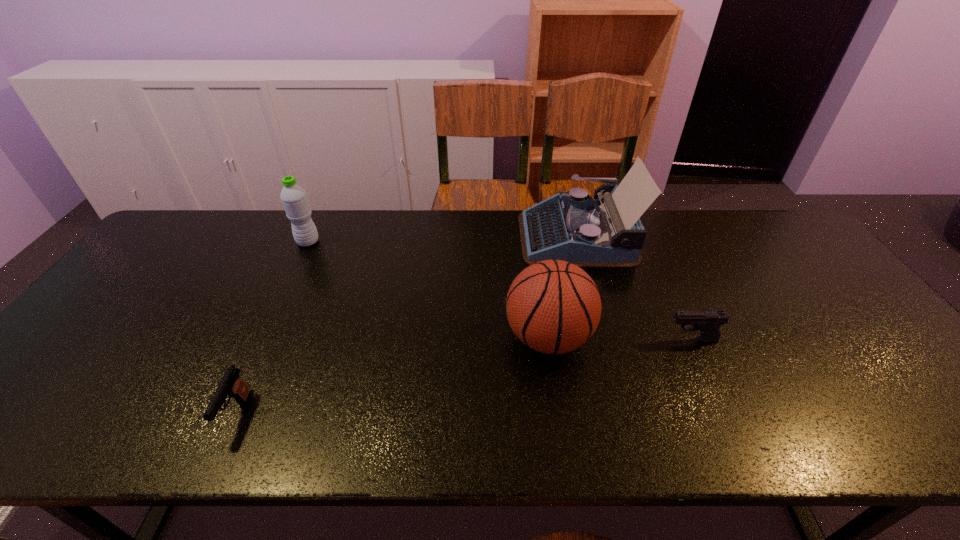
Identify the location of vacant space located 0.120m on the side where the inflation valve is located. The height and width of the screenshot is (540, 960). 457,338.

You are a GUI agent. You are given a task and a screenshot of the screen. Output one action in this format:
    pyautogui.click(x=<x>, y=<y>)
    Task: Click on the free space located 0.110m on the side where the inflation valve is located
    The image size is (960, 540).
    Given the screenshot: What is the action you would take?
    pyautogui.click(x=461, y=338)

Identify the location of free spot located on the side where the inflation valve is located. This screenshot has height=540, width=960. (394, 338).

Image resolution: width=960 pixels, height=540 pixels. Find the location of `blank space located 0.100m at the barrel of the farther pistol`. blank space located 0.100m at the barrel of the farther pistol is located at coordinates pos(627,340).

Image resolution: width=960 pixels, height=540 pixels. What are the coordinates of `vacant region located 0.080m at the barrel of the farther pistol` in the screenshot? It's located at (635, 340).

Where is `free location located 0.300m at the barrel of the farther pistol`? This screenshot has height=540, width=960. free location located 0.300m at the barrel of the farther pistol is located at coordinates click(547, 340).

Locate an element on the screen. The image size is (960, 540). typewriter at the far edge is located at coordinates (589, 233).

What are the coordinates of `water bottle at the far edge` in the screenshot? It's located at (294, 199).

At what (x,y) coordinates should I click in order to perform the action: click on object that is at the near edge. Please return your answer as a coordinate pair (x, y). Looking at the image, I should click on (231, 385).

At what (x,y) coordinates should I click in order to perform the action: click on vacant region at the far edge of the desktop. Please return your answer as a coordinate pair (x, y). The height and width of the screenshot is (540, 960). Looking at the image, I should click on (409, 239).